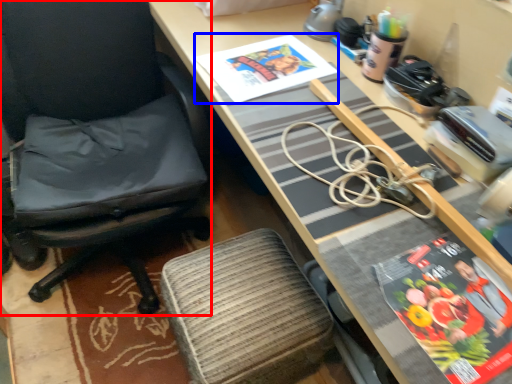
Question: Among these objects, which one is farthest to the camera, chair (highlighted by a red box) or book cover (highlighted by a blue box)?

Choices:
 (A) chair
 (B) book cover

Answer: (B)